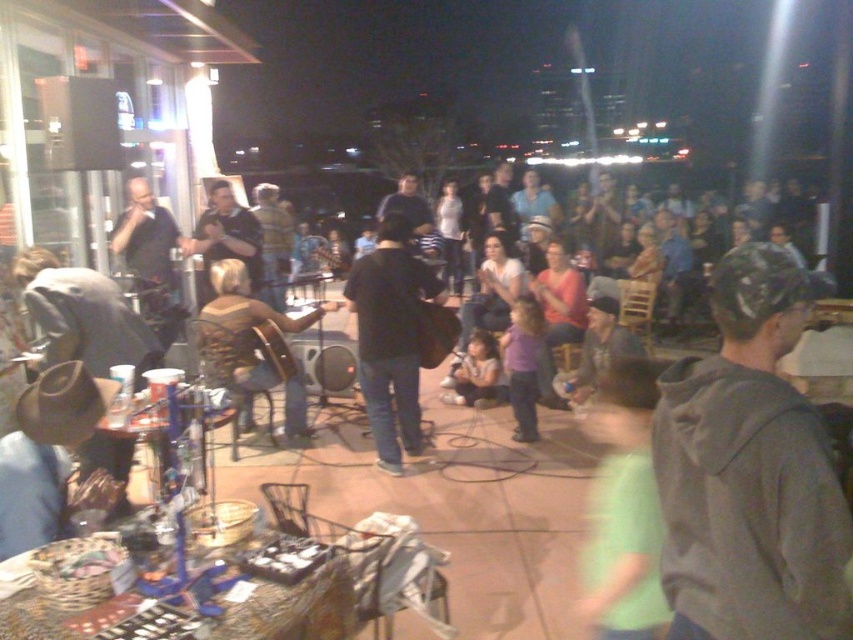
You are a photographer at the event and want to capture both the gray matte hoodie at center and the brown leather guitar at center in a single shot. Which object should you position closer to the left side of the frame to ensure both are visible?

To ensure both the gray matte hoodie at center and the brown leather guitar at center are visible in the frame, position the brown leather guitar at center on the left side since the gray matte hoodie at center is currently on the right side of it.

Looking at this image, you are a photographer at the event and want to capture both the gray matte hoodie at center and the black leather jacket at center in a single shot. Which clothing item will appear smaller in the photo?

The gray matte hoodie at center will appear smaller in the photo because it is not as tall as the black leather jacket at center.

You are organizing a small outdoor event and need to place a 3.5 meter long banner between the gray matte hoodie at center and the black leather jacket at center. Will the banner fit between them?

The gray matte hoodie at center and the black leather jacket at center are 2.98 meters apart, so the 3.5 meter banner will not fit between them as it is longer than the distance between the two objects.